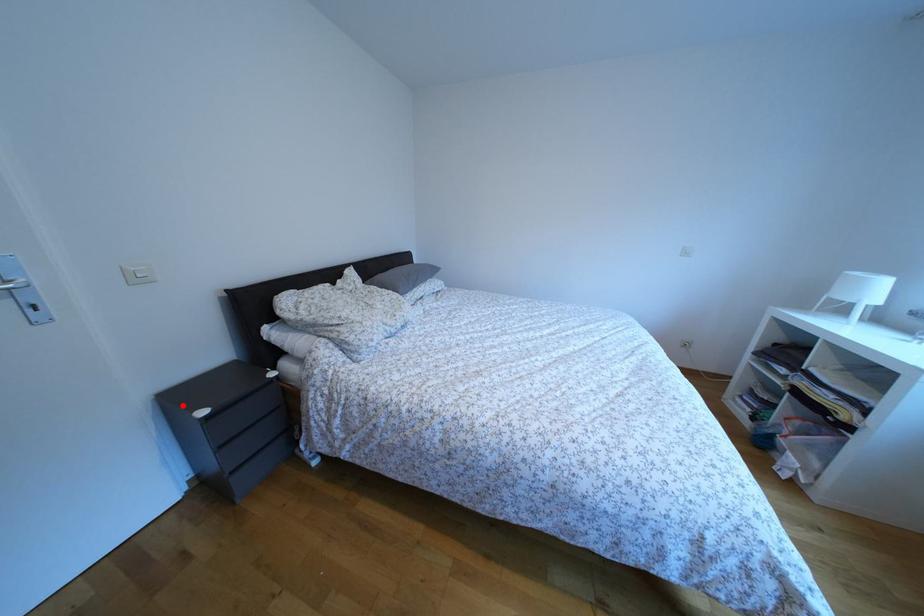
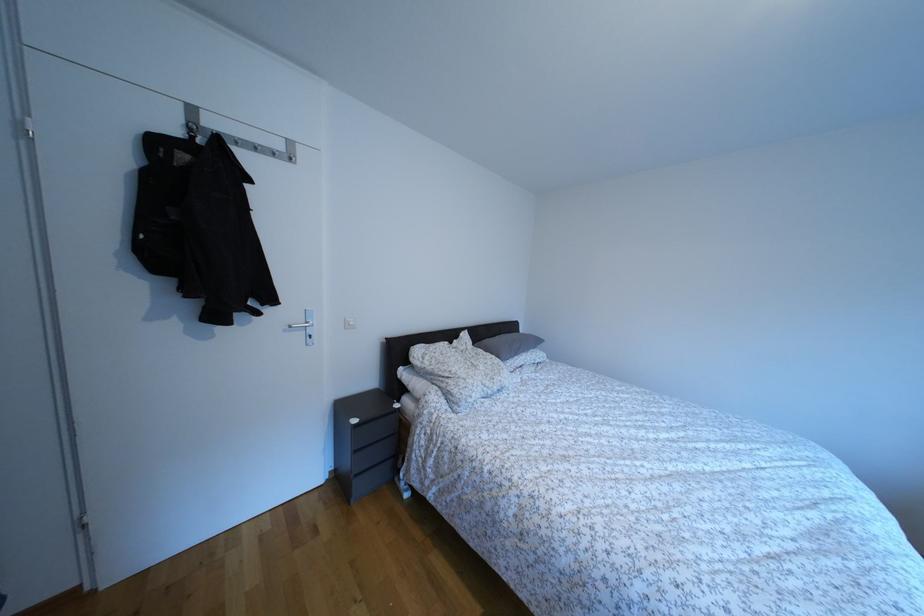
Find the pixel in the second image that matches the highlighted location in the first image.

(349, 413)